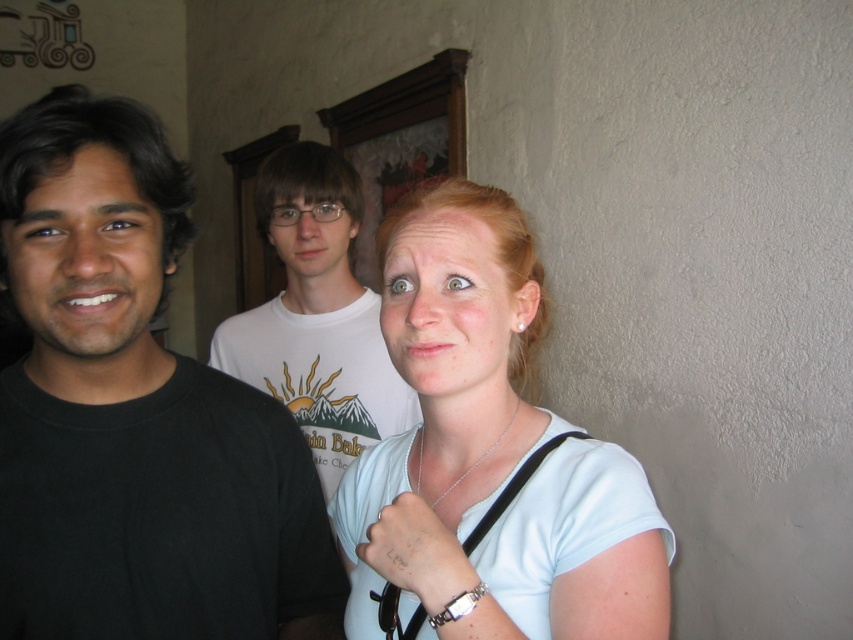
You are standing in the room where the three individuals are positioned. You need to place a decorative sticker exactly at the coordinates mentioned in the scene. Which person is wearing the black matte shirt at left, and where should you place the sticker relative to them?

The black matte shirt at left is worn by the person on the left. The sticker should be placed at the coordinates point (132, 410) relative to this person.

You are trying to decide which shirt to wear for a photoshoot. The photographer wants the shirt that is taller in the image. Which one should you choose between the black matte shirt at left and the light blue fabric shirt at center?

The black matte shirt at left is taller than the light blue fabric shirt at center, so you should choose the black matte shirt at left for the photoshoot.